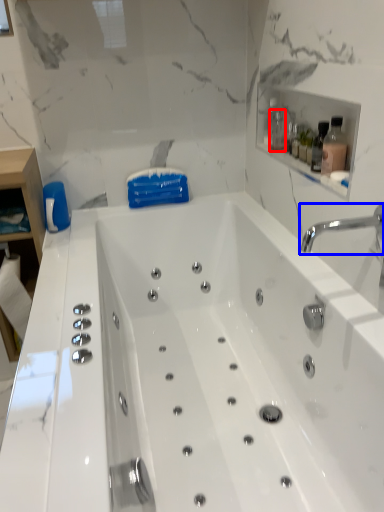
Question: Which object is further to the camera taking this photo, bottle (highlighted by a red box) or tap (highlighted by a blue box)?

Choices:
 (A) bottle
 (B) tap

Answer: (A)